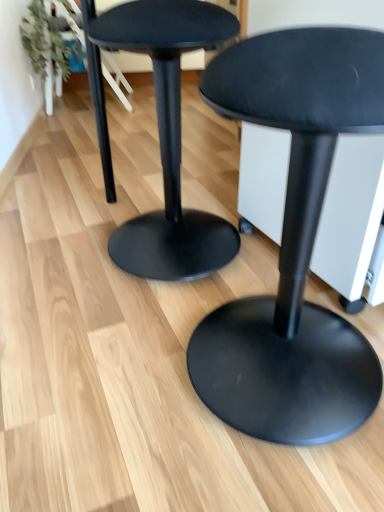
Locate an element on the screen. This screenshot has height=512, width=384. matte black stool at center, marked as the second stool in a left-to-right arrangement is located at coordinates (293, 242).

This screenshot has width=384, height=512. What do you see at coordinates (293, 242) in the screenshot? I see `matte black stool at center, marked as the second stool in a left-to-right arrangement` at bounding box center [293, 242].

What do you see at coordinates (169, 139) in the screenshot? I see `matte black stool at center, which appears as the 2th stool when viewed from the right` at bounding box center [169, 139].

Image resolution: width=384 pixels, height=512 pixels. In order to click on matte black stool at center, the first stool viewed from the left in this screenshot , I will do `click(169, 139)`.

At what (x,y) coordinates should I click in order to perform the action: click on matte black stool at center, marked as the second stool in a left-to-right arrangement. Please return your answer as a coordinate pair (x, y). The height and width of the screenshot is (512, 384). Looking at the image, I should click on (293, 242).

Between matte black stool at center, marked as the second stool in a left-to-right arrangement, and matte black stool at center, the first stool viewed from the left, which one appears on the right side from the viewer's perspective?

matte black stool at center, marked as the second stool in a left-to-right arrangement.

Considering the relative positions of matte black stool at center, the 1th stool positioned from the right, and matte black stool at center, the first stool viewed from the left, in the image provided, is matte black stool at center, the 1th stool positioned from the right, behind matte black stool at center, the first stool viewed from the left,?

No.

Which point is more forward, (x=357, y=45) or (x=204, y=258)?

The point (x=357, y=45) is closer to the camera.

Consider the image. From the image's perspective, which object appears higher, matte black stool at center, marked as the second stool in a left-to-right arrangement, or matte black stool at center, which appears as the 2th stool when viewed from the right?

matte black stool at center, which appears as the 2th stool when viewed from the right, appears higher in the image.

In the scene shown: From a real-world perspective, between matte black stool at center, the 1th stool positioned from the right, and matte black stool at center, the first stool viewed from the left, who is vertically higher?

matte black stool at center, the first stool viewed from the left, is physically above.

Which of these two, matte black stool at center, marked as the second stool in a left-to-right arrangement, or matte black stool at center, which appears as the 2th stool when viewed from the right, is thinner?

matte black stool at center, which appears as the 2th stool when viewed from the right.

Consider the image. Is matte black stool at center, marked as the second stool in a left-to-right arrangement, shorter than matte black stool at center, which appears as the 2th stool when viewed from the right?

No.

Is matte black stool at center, the 1th stool positioned from the right, bigger than matte black stool at center, which appears as the 2th stool when viewed from the right?

Yes, matte black stool at center, the 1th stool positioned from the right, is bigger than matte black stool at center, which appears as the 2th stool when viewed from the right.

Consider the image. Can we say matte black stool at center, marked as the second stool in a left-to-right arrangement, lies outside matte black stool at center, which appears as the 2th stool when viewed from the right?

Yes, matte black stool at center, marked as the second stool in a left-to-right arrangement, is not within matte black stool at center, which appears as the 2th stool when viewed from the right.

Is matte black stool at center, marked as the second stool in a left-to-right arrangement, far from matte black stool at center, the first stool viewed from the left?

No.

Is matte black stool at center, which appears as the 2th stool when viewed from the right, at the back of matte black stool at center, the 1th stool positioned from the right?

That's not correct — matte black stool at center, the 1th stool positioned from the right, is not looking away from matte black stool at center, which appears as the 2th stool when viewed from the right.

How many degrees apart are the facing directions of matte black stool at center, the 1th stool positioned from the right, and matte black stool at center, which appears as the 2th stool when viewed from the right?

The angular difference between matte black stool at center, the 1th stool positioned from the right, and matte black stool at center, which appears as the 2th stool when viewed from the right, is 0.000129 degrees.

There is a matte black stool at center, marked as the second stool in a left-to-right arrangement. Identify the location of stool above it (from a real-world perspective). (169, 139).

Is matte black stool at center, which appears as the 2th stool when viewed from the right, to the left of matte black stool at center, marked as the second stool in a left-to-right arrangement, from the viewer's perspective?

Yes, matte black stool at center, which appears as the 2th stool when viewed from the right, is to the left of matte black stool at center, marked as the second stool in a left-to-right arrangement.

In the scene shown: Is matte black stool at center, the first stool viewed from the left, in front of or behind matte black stool at center, the 1th stool positioned from the right, in the image?

Visually, matte black stool at center, the first stool viewed from the left, is located behind matte black stool at center, the 1th stool positioned from the right.

Is point (97, 28) positioned behind point (315, 142)?

Yes, point (97, 28) is farther from viewer.

From the image's perspective, is matte black stool at center, the first stool viewed from the left, under matte black stool at center, the 1th stool positioned from the right?

No, from the image's perspective, matte black stool at center, the first stool viewed from the left, is not beneath matte black stool at center, the 1th stool positioned from the right.

In the scene shown: From a real-world perspective, is matte black stool at center, the first stool viewed from the left, positioned over matte black stool at center, the 1th stool positioned from the right, based on gravity?

Yes, from a real-world perspective, matte black stool at center, the first stool viewed from the left, is over matte black stool at center, the 1th stool positioned from the right

Which of these two, matte black stool at center, the first stool viewed from the left, or matte black stool at center, marked as the second stool in a left-to-right arrangement, is thinner?

Thinner between the two is matte black stool at center, the first stool viewed from the left.

Considering the relative sizes of matte black stool at center, the first stool viewed from the left, and matte black stool at center, the 1th stool positioned from the right, in the image provided, is matte black stool at center, the first stool viewed from the left, shorter than matte black stool at center, the 1th stool positioned from the right,?

Yes.

Can you confirm if matte black stool at center, the first stool viewed from the left, is smaller than matte black stool at center, the 1th stool positioned from the right?

Indeed, matte black stool at center, the first stool viewed from the left, has a smaller size compared to matte black stool at center, the 1th stool positioned from the right.

Is matte black stool at center, which appears as the 2th stool when viewed from the right, spatially inside matte black stool at center, marked as the second stool in a left-to-right arrangement, or outside of it?

matte black stool at center, which appears as the 2th stool when viewed from the right, exists outside the volume of matte black stool at center, marked as the second stool in a left-to-right arrangement.

Is matte black stool at center, which appears as the 2th stool when viewed from the right, beside matte black stool at center, marked as the second stool in a left-to-right arrangement?

They are not placed beside each other.

Is matte black stool at center, the first stool viewed from the left, turned away from matte black stool at center, the 1th stool positioned from the right?

No.

What's the angular difference between matte black stool at center, the first stool viewed from the left, and matte black stool at center, marked as the second stool in a left-to-right arrangement,'s facing directions?

The angular difference between matte black stool at center, the first stool viewed from the left, and matte black stool at center, marked as the second stool in a left-to-right arrangement, is 0.000129 degrees.

I want to click on stool behind the matte black stool at center, the 1th stool positioned from the right, so click(x=169, y=139).

This screenshot has width=384, height=512. I want to click on stool located on the right of matte black stool at center, the first stool viewed from the left, so click(x=293, y=242).

The image size is (384, 512). I want to click on stool located above the matte black stool at center, the 1th stool positioned from the right (from the image's perspective), so click(x=169, y=139).